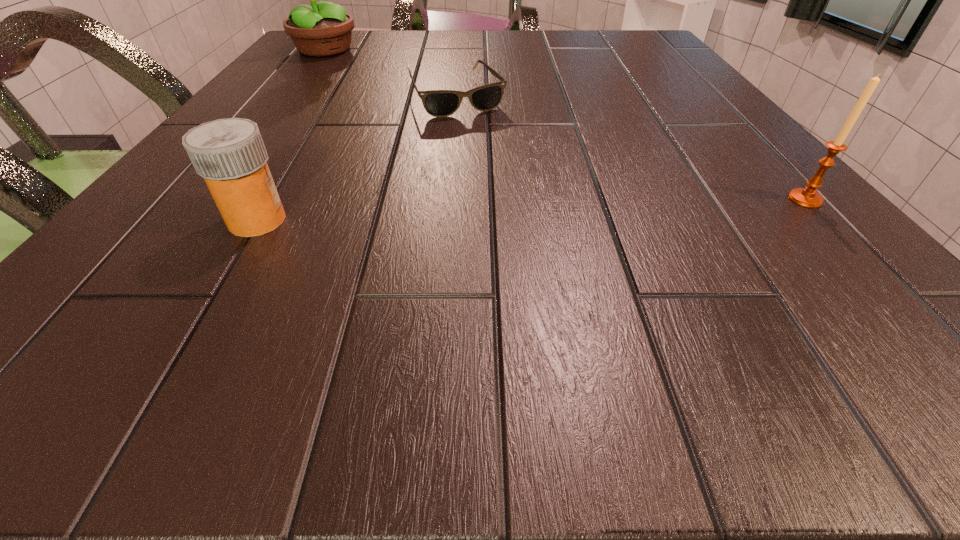
Identify the location of the second shortest object. The height and width of the screenshot is (540, 960). (230, 155).

Identify the location of candle_holder. (807, 197).

The image size is (960, 540). Identify the location of the rightmost object. (807, 197).

Locate an element on the screen. The image size is (960, 540). the second farthest object is located at coordinates (439, 103).

At what (x,y) coordinates should I click in order to perform the action: click on sunglasses. Please return your answer as a coordinate pair (x, y). Looking at the image, I should click on (439, 103).

Locate an element on the screen. sunflower is located at coordinates (323, 29).

Where is `the farthest object`? The width and height of the screenshot is (960, 540). the farthest object is located at coordinates (323, 29).

Find the location of a particular element. The image size is (960, 540). free space located 0.230m on the label side of the medicine is located at coordinates (464, 220).

Where is `vacant space situated on the back of the rightmost object`? The image size is (960, 540). vacant space situated on the back of the rightmost object is located at coordinates (713, 102).

I want to click on vacant space located 0.360m on the lenses of the sunglasses, so click(556, 236).